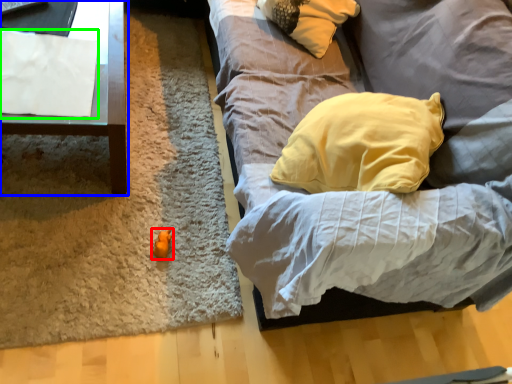
Question: Which object is the closest to the toy (highlighted by a red box)? Choose among these: furniture (highlighted by a blue box) or sheet (highlighted by a green box).

Choices:
 (A) furniture
 (B) sheet

Answer: (A)